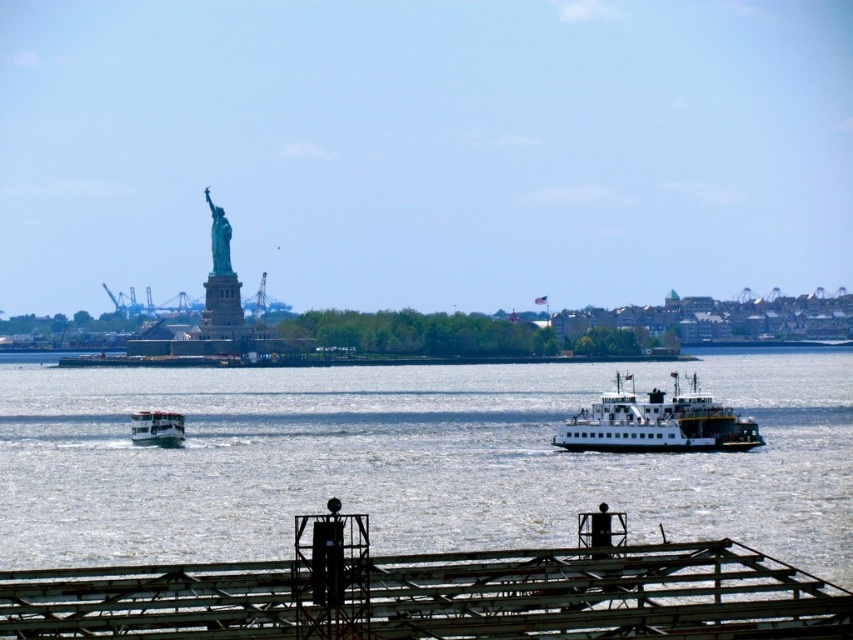
You are a photographer trying to capture the green patina statue at upper left and the white matte ferry at center in the same frame. Based on their heights, which object will appear taller in your photo?

The green patina statue at upper left will appear taller in the photo because it has a greater height than the white matte ferry at center.

You are a tourist standing on the dock and want to take a photo of both the white matte ferry at center and the white matte ferryboat at center. Which one should you zoom in on to capture the entire vessel in the frame without cropping?

You should zoom in on the white matte ferryboat at center because its width is narrower than the white matte ferry at center, making it easier to fit entirely within the camera frame.

You are standing at the viewpoint where the image was taken. There are two points marked in the scene. Which point, point (x=134, y=422) or point (x=209, y=209), is closer to you?

Point (x=134, y=422) is closer to you than point (x=209, y=209).